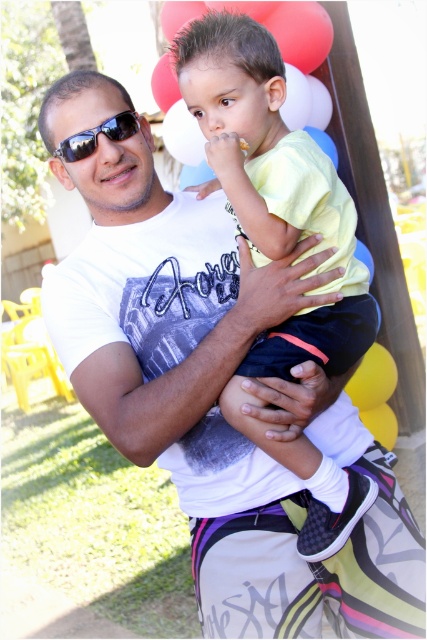
Question: Which point is farther to the camera?

Choices:
 (A) white matte balloon at upper center
 (B) sunglasses at center
 (C) red matte balloon at upper center
 (D) yellow matte balloon at center

Answer: (D)

Question: Is red matte balloon at upper center positioned before white matte balloon at upper center?

Choices:
 (A) no
 (B) yes

Answer: (A)

Question: Which is nearer to the red matte balloon at upper center?

Choices:
 (A) sunglasses at center
 (B) white matte balloon at upper center
 (C) yellow matte balloon at center

Answer: (B)

Question: Observing the image, what is the correct spatial positioning of yellow matte shirt at center in reference to yellow matte balloon at center?

Choices:
 (A) below
 (B) above

Answer: (B)

Question: Does red matte balloon at upper center appear under sunglasses at center?

Choices:
 (A) yes
 (B) no

Answer: (B)

Question: Which of the following is the closest to the observer?

Choices:
 (A) red matte balloon at upper center
 (B) yellow matte balloon at center
 (C) white matte balloon at upper center
 (D) yellow matte shirt at center

Answer: (D)